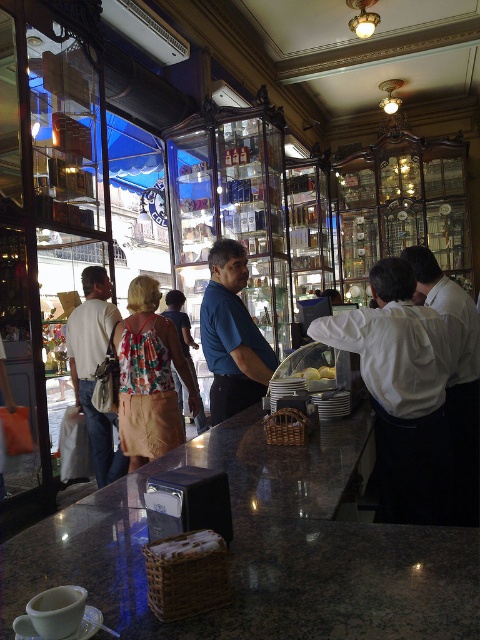
Locate an element on the screen. The width and height of the screenshot is (480, 640). blue smooth shirt at center is located at coordinates (231, 336).

Who is more forward, (232, 362) or (315, 368)?

Point (232, 362)

Looking at this image, can you confirm if blue smooth shirt at center is smaller than yellow cake at center?

Incorrect, blue smooth shirt at center is not smaller in size than yellow cake at center.

Is point (254, 330) farther from viewer compared to point (328, 376)?

Yes, it is.

The image size is (480, 640). I want to click on blue smooth shirt at center, so click(x=231, y=336).

Consider the image. Is granite countertop at center thinner than floral fabric dress at center?

Incorrect, granite countertop at center's width is not less than floral fabric dress at center's.

Is granite countertop at center shorter than floral fabric dress at center?

Yes, granite countertop at center is shorter than floral fabric dress at center.

You are a GUI agent. You are given a task and a screenshot of the screen. Output one action in this format:
    pyautogui.click(x=<x>, y=<y>)
    Task: Click on the granite countertop at center
    
    Given the screenshot: What is the action you would take?
    pyautogui.click(x=262, y=548)